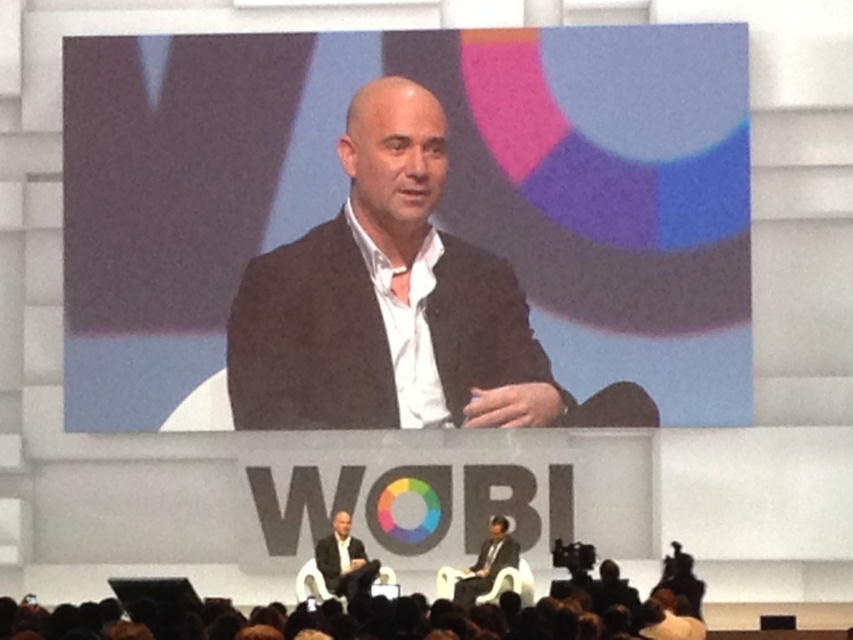
You are an attendee at this conference. You notice two elements in the scene described as the matte black screen at center and the brown hair at lower center. Based on their positions, which one would you look towards first if you were facing the stage?

The brown hair at lower center is to the left of the matte black screen at center, so you would naturally look towards the brown hair at lower center first since it is positioned to the left.

You are attending a professional conference and notice two key elements in the image provided. The first is the brown hair at lower center and the second is the dark gray suit at center. Based on their positions, which object is located to the right of the other?

The brown hair at lower center is to the right of the dark gray suit at center.

You are standing at the back of the conference hall and want to see the matte black screen at center clearly. The screen is 266.30 feet away from you. Is this distance within the recommended viewing distance for a typical presentation screen?

The recommended viewing distance for a typical presentation screen is usually between 1.5 to 2.5 times the diagonal screen size. However, since the screen size isn not provided, it is not possible to determine if 266.30 feet is within the recommended range.